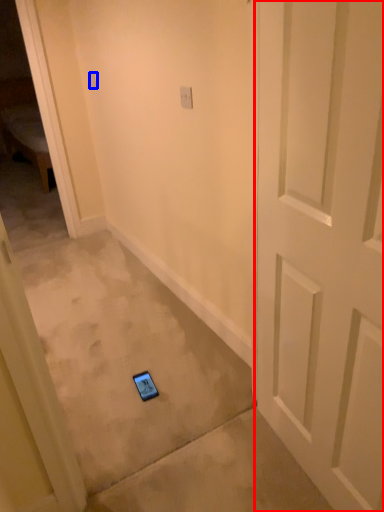
Question: Which object is closer to the camera taking this photo, door (highlighted by a red box) or light switch (highlighted by a blue box)?

Choices:
 (A) door
 (B) light switch

Answer: (A)